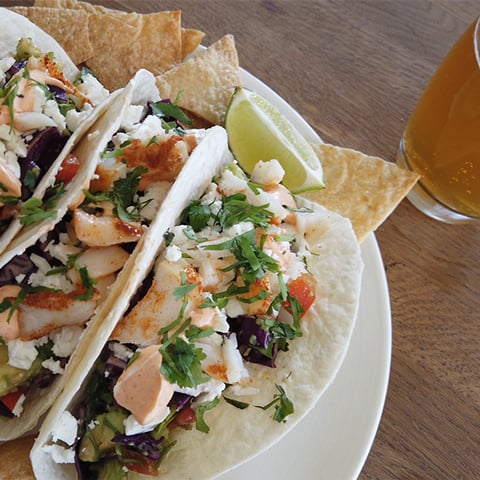
Where is `glass`? The width and height of the screenshot is (480, 480). glass is located at coordinates 444,151.